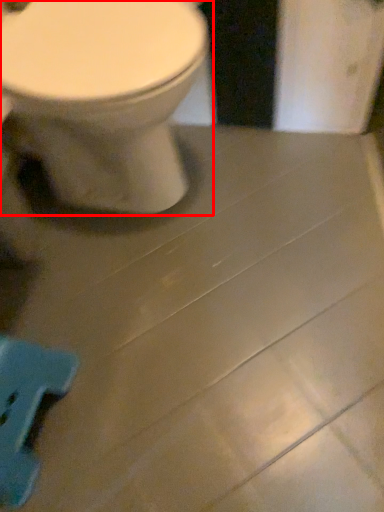
Question: From the image's perspective, where is toilet (annotated by the red box) located in relation to porcelain in the image?

Choices:
 (A) below
 (B) above

Answer: (B)